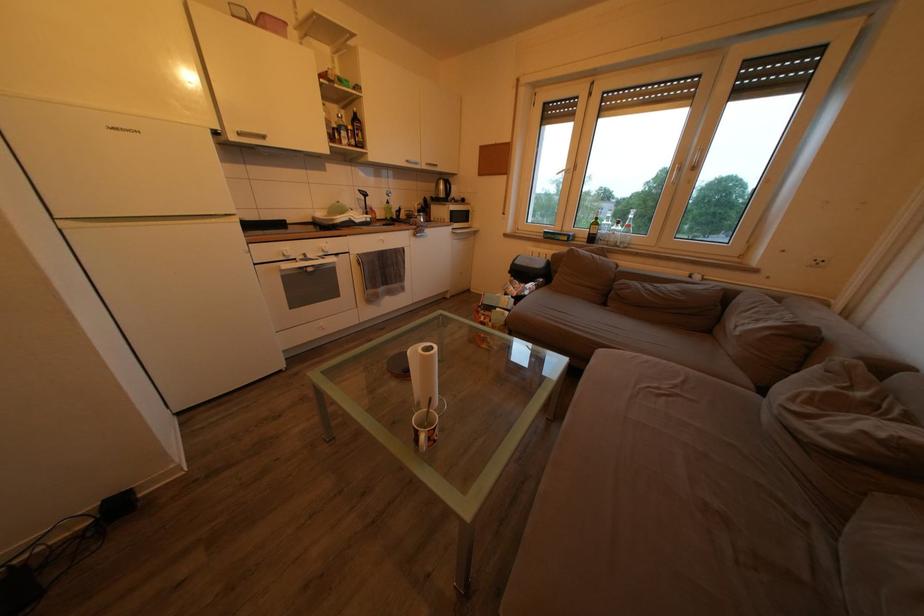
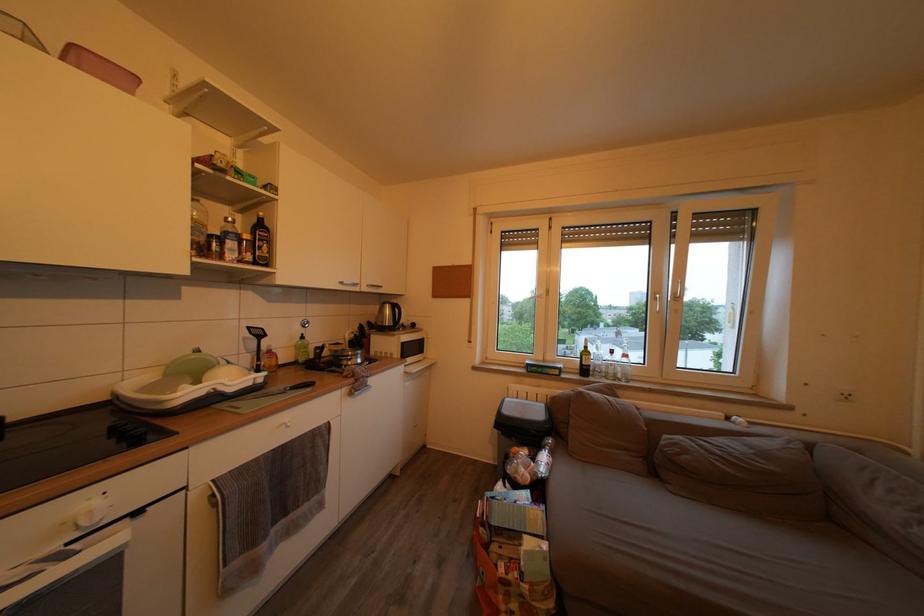
In the second image, find the point that corresponds to point 699,168 in the first image.

(682, 300)